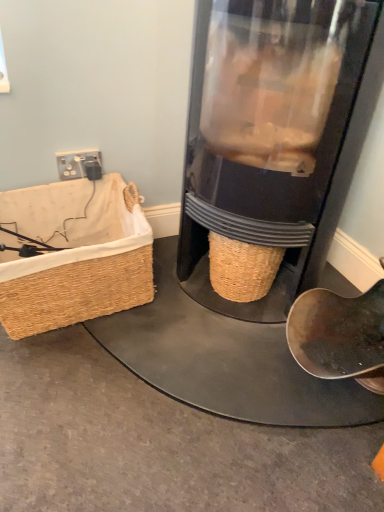
Where is `vacant space in front of transparent plastic coffee grinder at center`? The image size is (384, 512). vacant space in front of transparent plastic coffee grinder at center is located at coordinates (202, 405).